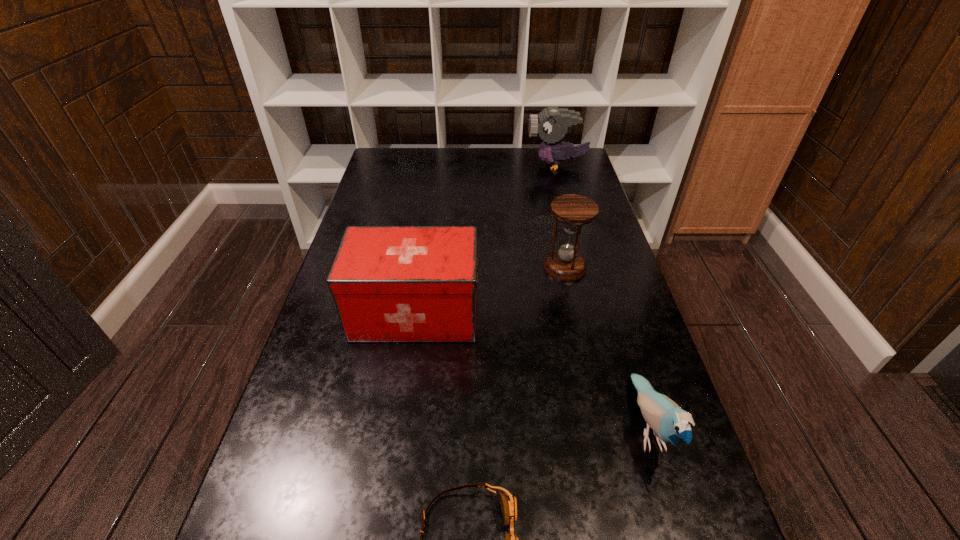
Identify the location of vacant space that's between the farther bird and the first-aid kit. (486, 239).

Find the location of a particular element. The image size is (960, 540). vacant area that lies between the first-aid kit and the second farthest object is located at coordinates click(491, 291).

The height and width of the screenshot is (540, 960). Find the location of `empty location between the first-aid kit and the hourglass`. empty location between the first-aid kit and the hourglass is located at coordinates (491, 291).

Where is `vacant area between the nearer bird and the second farthest object`? vacant area between the nearer bird and the second farthest object is located at coordinates (607, 347).

Identify which object is the nearest to the fourth farthest object. Please provide its 2D coordinates. Your answer should be formatted as a tuple, i.e. [(x, y)], where the tuple contains the x and y coordinates of a point satisfying the conditions above.

[(508, 502)]

Find the location of a particular element. the closest object to the second farthest object is located at coordinates (389, 283).